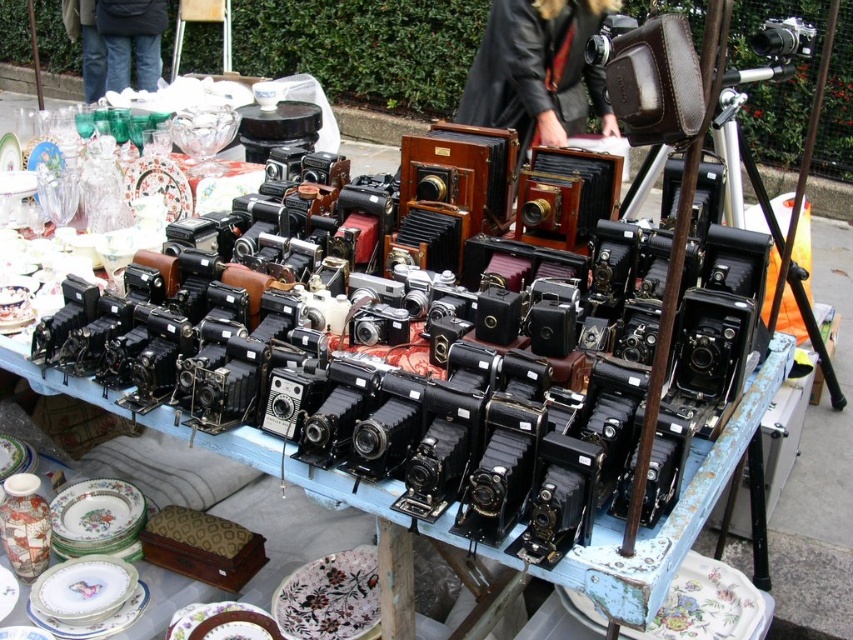
Is point (486, 76) positioned after point (786, 51)?

Yes, it is.

Between point (462, 97) and point (810, 51), which one is positioned behind?

The point (462, 97) is more distant.

The image size is (853, 640). In order to click on brown leather camera case at center in this screenshot , I will do `click(537, 70)`.